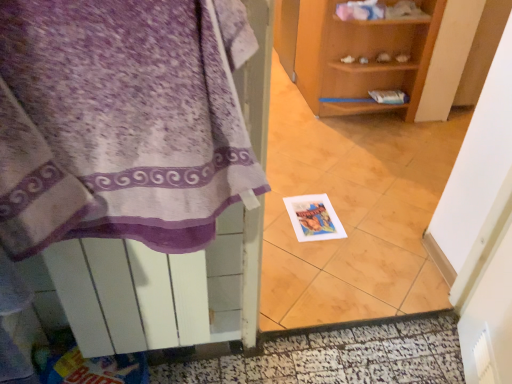
What is the approximate height of wooden shelf at center?

wooden shelf at center is 29.22 inches in height.

Locate an element on the screen. The image size is (512, 384). purple fabric towel at left is located at coordinates (116, 125).

Locate an element on the screen. The height and width of the screenshot is (384, 512). white glossy door at lower center is located at coordinates (331, 355).

Describe the element at coordinates (314, 218) in the screenshot. I see `white paper postcard at center` at that location.

Describe the element at coordinates (353, 212) in the screenshot. This screenshot has width=512, height=384. I see `white glossy tile at center` at that location.

Where is `wooden shelf at center`? This screenshot has width=512, height=384. wooden shelf at center is located at coordinates (376, 54).

Is white paper postcard at center touching white glossy door at lower center?

No, white paper postcard at center is not next to white glossy door at lower center.

Looking at the image, does white paper postcard at center seem bigger or smaller compared to white glossy door at lower center?

In the image, white paper postcard at center appears to be smaller than white glossy door at lower center.

Can we say white paper postcard at center lies outside white glossy door at lower center?

white paper postcard at center lies outside white glossy door at lower center's area.

How different are the orientations of white paper postcard at center and white glossy door at lower center in degrees?

There is a 179-degree angle between the facing directions of white paper postcard at center and white glossy door at lower center.

Considering the sizes of objects purple fabric towel at left and white glossy door at lower center in the image provided, who is shorter, purple fabric towel at left or white glossy door at lower center?

Standing shorter between the two is white glossy door at lower center.

How many degrees apart are the facing directions of purple fabric towel at left and white glossy door at lower center?

There is a 91-degree angle between the facing directions of purple fabric towel at left and white glossy door at lower center.

From a real-world perspective, is purple fabric towel at left above or below white glossy door at lower center?

From a real-world perspective, purple fabric towel at left is physically above white glossy door at lower center.

Considering the sizes of purple fabric towel at left and white glossy door at lower center in the image, is purple fabric towel at left wider or thinner than white glossy door at lower center?

In the image, purple fabric towel at left appears to be wider than white glossy door at lower center.

From the image's perspective, is wooden shelf at center over white glossy door at lower center?

Yes, from the image's perspective, wooden shelf at center is above white glossy door at lower center.

How many degrees apart are the facing directions of wooden shelf at center and white glossy door at lower center?

The angle between the facing direction of wooden shelf at center and the facing direction of white glossy door at lower center is 90.6 degrees.

Which object is further away from the camera, wooden shelf at center or white glossy door at lower center?

Positioned behind is wooden shelf at center.

Is wooden shelf at center far away from white glossy door at lower center?

Absolutely, wooden shelf at center is distant from white glossy door at lower center.

Does white paper postcard at center have a lesser width compared to white glossy tile at center?

No.

In the scene shown: Could you tell me if white paper postcard at center is turned towards white glossy tile at center?

Yes, white paper postcard at center is oriented towards white glossy tile at center.

Based on their sizes in the image, would you say white paper postcard at center is bigger or smaller than white glossy tile at center?

In the image, white paper postcard at center appears to be smaller than white glossy tile at center.

Is white paper postcard at center with white glossy tile at center?

No, white paper postcard at center is not touching white glossy tile at center.

Is wooden shelf at center next to purple fabric towel at left?

No, wooden shelf at center is not in contact with purple fabric towel at left.

Between wooden shelf at center and purple fabric towel at left, which one has larger width?

Wider between the two is wooden shelf at center.

Is wooden shelf at center to the right of purple fabric towel at left from the viewer's perspective?

Yes, wooden shelf at center is to the right of purple fabric towel at left.

Considering the relative positions of wooden shelf at center and purple fabric towel at left in the image provided, is wooden shelf at center in front of purple fabric towel at left?

No, wooden shelf at center is further to the viewer.

Who is smaller, white glossy tile at center or white glossy door at lower center?

With smaller size is white glossy door at lower center.

From a real-world perspective, is white glossy tile at center above or below white glossy door at lower center?

white glossy tile at center is situated higher than white glossy door at lower center in the real world.

Locate an element on the screen. Image resolution: width=512 pixels, height=384 pixels. tile lying on the right of white glossy door at lower center is located at coordinates (353, 212).

Is white glossy tile at center completely or partially outside of white glossy door at lower center?

Yes.

Is white paper postcard at center behind wooden shelf at center?

No, white paper postcard at center is in front of wooden shelf at center.

Which of these two, white paper postcard at center or wooden shelf at center, is bigger?

Bigger between the two is wooden shelf at center.

Based on the photo, between white paper postcard at center and wooden shelf at center, which one has larger width?

With larger width is wooden shelf at center.

What are the coordinates of `door below the white paper postcard at center (from a real-world perspective)` in the screenshot? It's located at (331, 355).

This screenshot has height=384, width=512. I want to click on cabinetry that appears on the left of white glossy door at lower center, so click(116, 125).

Looking at the image, which one is located further to white glossy tile at center, white glossy door at lower center or white paper postcard at center?

Based on the image, white glossy door at lower center appears to be further to white glossy tile at center.

When comparing their distances from white glossy tile at center, does wooden shelf at center or white glossy door at lower center seem closer?

Among the two, wooden shelf at center is located nearer to white glossy tile at center.

Consider the image. Estimate the real-world distances between objects in this image. Which object is closer to white paper postcard at center, white glossy tile at center or white glossy door at lower center?

Among the two, white glossy tile at center is located nearer to white paper postcard at center.

Consider the image. Considering their positions, is white glossy door at lower center positioned closer to purple fabric towel at left than white glossy tile at center?

The object closer to purple fabric towel at left is white glossy door at lower center.

Looking at this image, which object lies nearer to the anchor point wooden shelf at center, white glossy tile at center or purple fabric towel at left?

white glossy tile at center is positioned closer to the anchor wooden shelf at center.

When comparing their distances from purple fabric towel at left, does wooden shelf at center or white glossy door at lower center seem further?

wooden shelf at center is further to purple fabric towel at left.

Looking at the image, which one is located further to purple fabric towel at left, white glossy door at lower center or wooden shelf at center?

wooden shelf at center.

Estimate the real-world distances between objects in this image. Which object is further from wooden shelf at center, white glossy door at lower center or purple fabric towel at left?

purple fabric towel at left lies further to wooden shelf at center than the other object.

The image size is (512, 384). What are the coordinates of `cabinetry between wooden shelf at center and white glossy door at lower center in the up-down direction` in the screenshot? It's located at (116, 125).

Find the location of a particular element. Image resolution: width=512 pixels, height=384 pixels. tile positioned between purple fabric towel at left and wooden shelf at center from near to far is located at coordinates (353, 212).

Where is `door located between purple fabric towel at left and white paper postcard at center in the depth direction`? The height and width of the screenshot is (384, 512). door located between purple fabric towel at left and white paper postcard at center in the depth direction is located at coordinates (331, 355).

Identify the location of door located between purple fabric towel at left and white glossy tile at center in the left-right direction. The height and width of the screenshot is (384, 512). (331, 355).